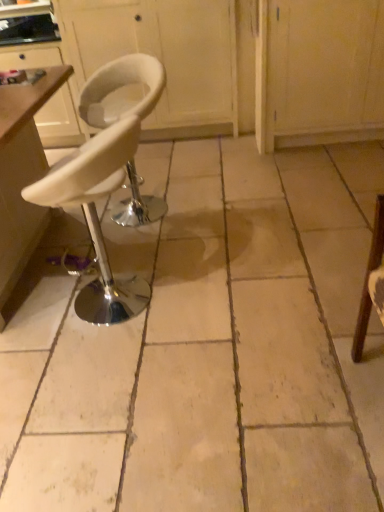
Question: Does white plastic table at left have a greater height compared to white leather stool at center?

Choices:
 (A) yes
 (B) no

Answer: (A)

Question: Is white plastic table at left oriented towards white leather stool at center?

Choices:
 (A) yes
 (B) no

Answer: (A)

Question: Is white plastic table at left behind white leather stool at center?

Choices:
 (A) no
 (B) yes

Answer: (B)

Question: From the image's perspective, would you say white plastic table at left is positioned over white leather stool at center?

Choices:
 (A) yes
 (B) no

Answer: (A)

Question: Does white plastic table at left come in front of white leather stool at center?

Choices:
 (A) yes
 (B) no

Answer: (B)

Question: Is white leather stool at center to the left or to the right of white matte cabinet at upper center in the image?

Choices:
 (A) left
 (B) right

Answer: (B)

Question: Is point (314, 425) positioned closer to the camera than point (205, 68)?

Choices:
 (A) closer
 (B) farther

Answer: (A)

Question: From a real-world perspective, is white leather stool at center positioned above or below white matte cabinet at upper center?

Choices:
 (A) below
 (B) above

Answer: (A)

Question: Is white leather stool at center taller or shorter than white matte cabinet at upper center?

Choices:
 (A) tall
 (B) short

Answer: (B)

Question: From the image's perspective, is white leather stool at center located above or below white matte stool at left, the first chair in the front-to-back sequence?

Choices:
 (A) above
 (B) below

Answer: (A)

Question: In the image, is white leather stool at center positioned in front of or behind white matte stool at left, the first chair in the front-to-back sequence?

Choices:
 (A) behind
 (B) front

Answer: (B)

Question: Do you think white leather stool at center is within white matte stool at left, the first chair in the front-to-back sequence, or outside of it?

Choices:
 (A) outside
 (B) inside

Answer: (A)

Question: Does point (284, 373) appear closer or farther from the camera than point (142, 304)?

Choices:
 (A) farther
 (B) closer

Answer: (B)

Question: Do you think white plastic table at left is within white leather stool at center, or outside of it?

Choices:
 (A) outside
 (B) inside

Answer: (A)

Question: Is point (23, 115) positioned closer to the camera than point (380, 356)?

Choices:
 (A) farther
 (B) closer

Answer: (B)